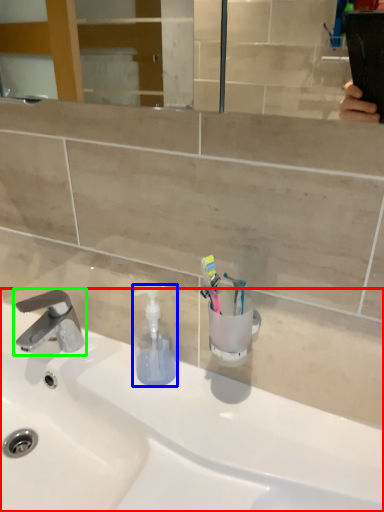
Question: Based on their relative distances, which object is farther from sink (highlighted by a red box)? Choose from soap dispenser (highlighted by a blue box) and tap (highlighted by a green box).

Choices:
 (A) soap dispenser
 (B) tap

Answer: (B)